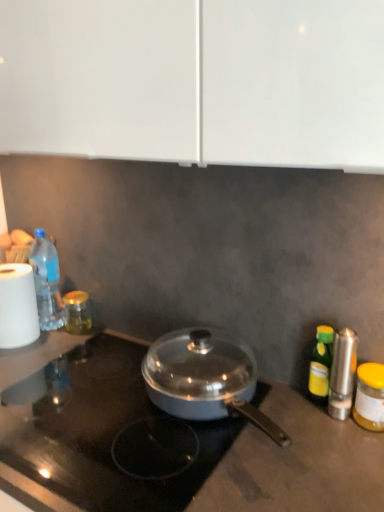
Find the location of a particular element. This screenshot has height=512, width=384. free space in front of yellow matte jar at right, positioned as the fourth bottle in left-to-right order is located at coordinates (x=357, y=465).